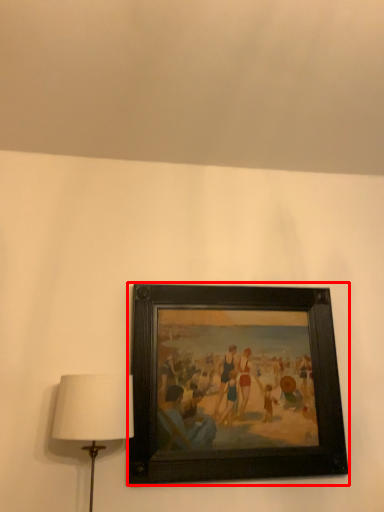
Question: From the image's perspective, where is picture frame (annotated by the red box) located in relation to lamp in the image?

Choices:
 (A) below
 (B) above

Answer: (B)